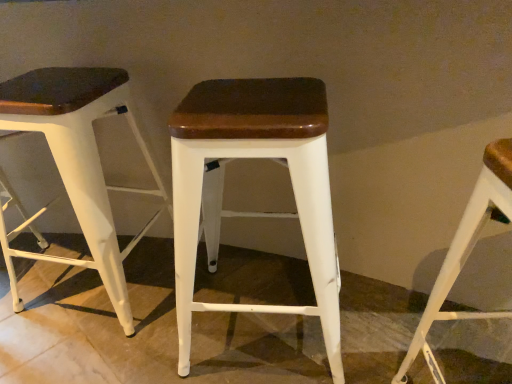
This screenshot has width=512, height=384. I want to click on empty space that is ontop of white matte wood stool at center, arranged as the second stool when viewed from the right, so [252, 101].